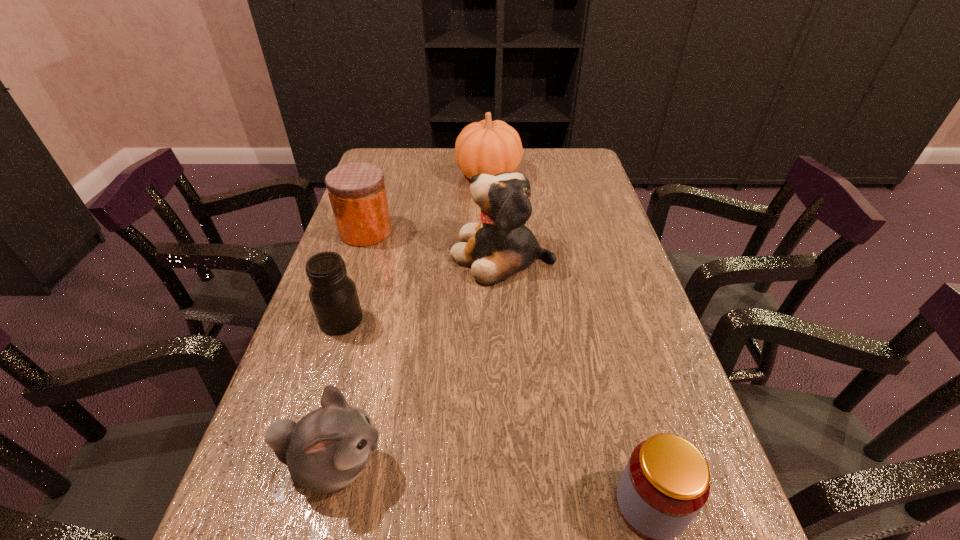
Where is `vacant space located 0.170m on the back of the third nearest object`? The height and width of the screenshot is (540, 960). vacant space located 0.170m on the back of the third nearest object is located at coordinates (361, 258).

Identify the location of vacant space located on the face of the hamster. [x=463, y=464].

Image resolution: width=960 pixels, height=540 pixels. What are the coordinates of `object at the far edge` in the screenshot? It's located at (489, 147).

In order to click on hamster that is at the left edge in this screenshot , I will do `click(325, 451)`.

The height and width of the screenshot is (540, 960). In the image, there is a desktop. What are the coordinates of `vacant region at the far edge` in the screenshot? It's located at (420, 163).

The height and width of the screenshot is (540, 960). Identify the location of vacant space at the right edge of the desktop. (600, 244).

Locate an element on the screen. free space at the far left corner of the desktop is located at coordinates (386, 181).

Identify the location of free space between the fourth farthest object and the farthest jar. (353, 276).

Locate an element on the screen. The width and height of the screenshot is (960, 540). free space between the farthest jar and the second nearest jar is located at coordinates (353, 276).

This screenshot has height=540, width=960. What are the coordinates of `vacant region between the puppy and the farthest jar` in the screenshot? It's located at (434, 243).